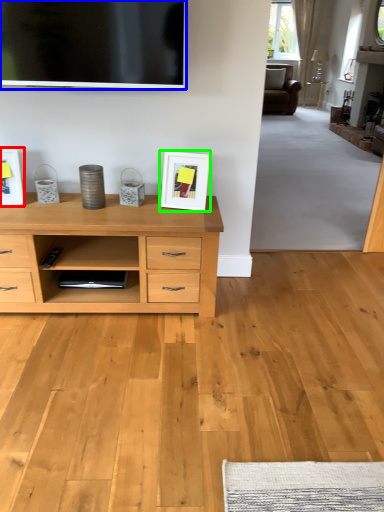
Question: Which is farther away from picture frame (highlighted by a red box)? television (highlighted by a blue box) or picture frame (highlighted by a green box)?

Choices:
 (A) television
 (B) picture frame

Answer: (B)